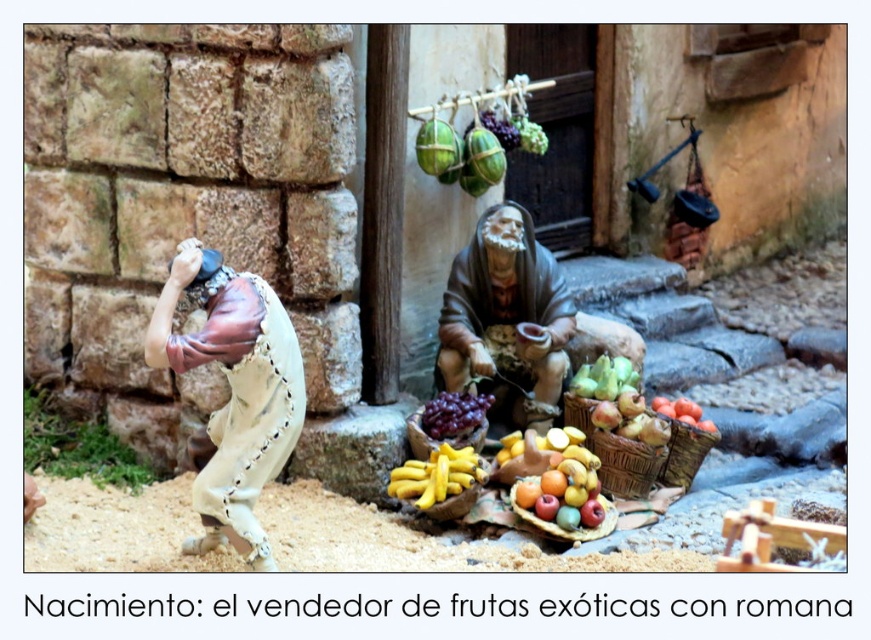
Question: Which object is the farthest from the shiny red tomatoes at lower right?

Choices:
 (A) woven brown basket at center
 (B) purple matte grapes at center
 (C) matte brown leather at left
 (D) green matte melon at center

Answer: (C)

Question: Can you confirm if matte brown robe at center is wider than yellow matte bananas at center?

Choices:
 (A) yes
 (B) no

Answer: (A)

Question: Which point appears closest to the camera in this image?

Choices:
 (A) (665, 413)
 (B) (429, 160)

Answer: (A)

Question: Can you confirm if matte brown leather at left is wider than green matte melon at center?

Choices:
 (A) yes
 (B) no

Answer: (A)

Question: Estimate the real-world distances between objects in this image. Which object is closer to the green matte melon at center?

Choices:
 (A) matte brown woven basket at center
 (B) yellow matte bananas at center

Answer: (A)

Question: Considering the relative positions of glossy wooden tray of fruits at center and yellow matte bananas at center in the image provided, where is glossy wooden tray of fruits at center located with respect to yellow matte bananas at center?

Choices:
 (A) above
 (B) below

Answer: (A)